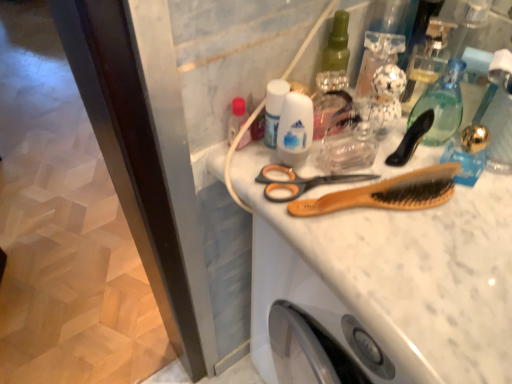
Identify the location of vacant area that is in front of white glossy mouthwash at center, which appears as the 2th mouthwash when viewed from the right. This screenshot has width=512, height=384. (329, 231).